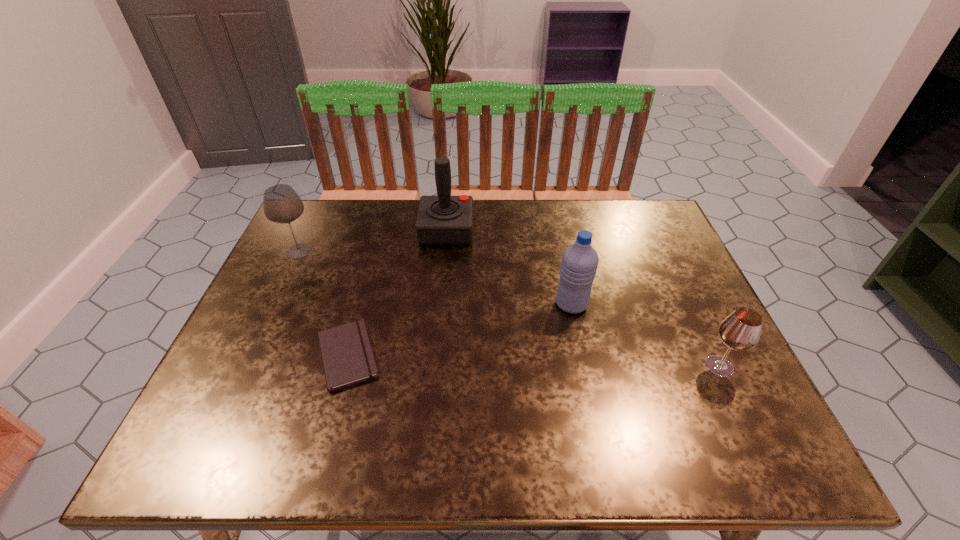
Image resolution: width=960 pixels, height=540 pixels. In order to click on the third object from right to left in this screenshot , I will do `click(443, 219)`.

The width and height of the screenshot is (960, 540). Find the location of `the second object from right to left`. the second object from right to left is located at coordinates (579, 263).

Where is `the third farthest object`? This screenshot has width=960, height=540. the third farthest object is located at coordinates (579, 263).

At what (x,y) coordinates should I click in order to perform the action: click on the left wineglass. Please return your answer as a coordinate pair (x, y). Looking at the image, I should click on (281, 204).

Identify the location of the leftmost object. (281, 204).

I want to click on the right wineglass, so click(x=741, y=330).

Find the location of `the nearer wineglass`. the nearer wineglass is located at coordinates (741, 330).

Where is `checkbook`? checkbook is located at coordinates (x=347, y=357).

Find the location of a particular element. Image resolution: width=960 pixels, height=540 pixels. the shortest object is located at coordinates (347, 357).

Locate an element on the screen. The width and height of the screenshot is (960, 540). vacant region located on the base of the third object from right to left is located at coordinates (496, 230).